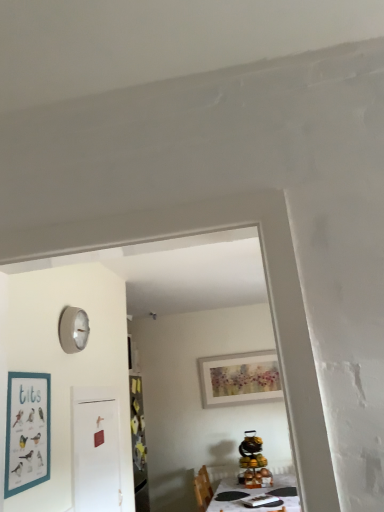
Measure the distance between white glossy table at lower center and camera.

The depth of white glossy table at lower center is 10.64 feet.

Find the location of a particular element. This screenshot has width=384, height=512. white glossy table at lower center is located at coordinates (256, 495).

What do you see at coordinates (27, 431) in the screenshot? I see `teal matte picture frame at left, the first picture frame from the front` at bounding box center [27, 431].

At what (x,y) coordinates should I click in order to perform the action: click on white glossy table at lower center. Please return your answer as a coordinate pair (x, y). This screenshot has width=384, height=512. Looking at the image, I should click on (256, 495).

From the picture: Which object is further away from the camera taking this photo, white glossy table at lower center or white matte door at center?

white glossy table at lower center is further away from the camera.

From a real-world perspective, does white glossy table at lower center sit lower than white matte door at center?

Correct, in the physical world, white glossy table at lower center is lower than white matte door at center.

Is white glossy table at lower center taller than white matte door at center?

Incorrect, the height of white glossy table at lower center is not larger of that of white matte door at center.

Which is in front, point (288, 498) or point (78, 415)?

Positioned in front is point (78, 415).

Would you consider teal matte picture frame at left, the 1th picture frame in the left-to-right sequence, to be distant from white matte door at center?

No, there isn't a large distance between teal matte picture frame at left, the 1th picture frame in the left-to-right sequence, and white matte door at center.

What's the angular difference between teal matte picture frame at left, marked as the second picture frame in a right-to-left arrangement, and white matte door at center's facing directions?

0.654 degrees separate the facing orientations of teal matte picture frame at left, marked as the second picture frame in a right-to-left arrangement, and white matte door at center.

How distant is teal matte picture frame at left, the second picture frame ordered from the bottom, from white matte door at center?

21.36 inches.

Considering the points (21, 429) and (82, 408), which point is behind, point (21, 429) or point (82, 408)?

Point (82, 408)

Does point (37, 464) lie in front of point (244, 354)?

That is True.

Is teal matte picture frame at left, the first picture frame from the front, next to watercolor paper picture frame at upper center, positioned as the second picture frame in top-to-bottom order, and touching it?

No, teal matte picture frame at left, the first picture frame from the front, is not touching watercolor paper picture frame at upper center, positioned as the second picture frame in top-to-bottom order.

Which of these two, teal matte picture frame at left, the 2th picture frame viewed from the back, or watercolor paper picture frame at upper center, arranged as the 1th picture frame when viewed from the right, stands taller?

Standing taller between the two is watercolor paper picture frame at upper center, arranged as the 1th picture frame when viewed from the right.

Is watercolor paper picture frame at upper center, which appears as the first picture frame when viewed from the back, far away from teal matte picture frame at left, the 1th picture frame when ordered from top to bottom?

watercolor paper picture frame at upper center, which appears as the first picture frame when viewed from the back, is far away from teal matte picture frame at left, the 1th picture frame when ordered from top to bottom.

I want to click on picture frame on the left of watercolor paper picture frame at upper center, the 1th picture frame positioned from the bottom, so click(x=27, y=431).

Between watercolor paper picture frame at upper center, arranged as the 2th picture frame when viewed from the front, and teal matte picture frame at left, marked as the second picture frame in a right-to-left arrangement, which one has smaller width?

Thinner between the two is teal matte picture frame at left, marked as the second picture frame in a right-to-left arrangement.

Would you say watercolor paper picture frame at upper center, the 1th picture frame positioned from the bottom, is inside or outside white matte door at center?

watercolor paper picture frame at upper center, the 1th picture frame positioned from the bottom, is located beyond the bounds of white matte door at center.

From a real-world perspective, is watercolor paper picture frame at upper center, arranged as the 1th picture frame when viewed from the right, positioned over white matte door at center based on gravity?

Correct, in the physical world, watercolor paper picture frame at upper center, arranged as the 1th picture frame when viewed from the right, is higher than white matte door at center.

From the image's perspective, is watercolor paper picture frame at upper center, marked as the 2th picture frame in a left-to-right arrangement, under white matte door at center?

Indeed, from the image's perspective, watercolor paper picture frame at upper center, marked as the 2th picture frame in a left-to-right arrangement, is shown beneath white matte door at center.

Is white matte door at center further to the viewer compared to teal matte picture frame at left, the 2th picture frame viewed from the back?

That is True.

Between white matte door at center and teal matte picture frame at left, the 1th picture frame in the left-to-right sequence, which one has less height?

teal matte picture frame at left, the 1th picture frame in the left-to-right sequence.

From the image's perspective, is white matte door at center on top of teal matte picture frame at left, the 1th picture frame when ordered from top to bottom?

Incorrect, from the image's perspective, white matte door at center is lower than teal matte picture frame at left, the 1th picture frame when ordered from top to bottom.

Is white glossy table at lower center turned away from teal matte picture frame at left, the first picture frame from the front?

No, white glossy table at lower center is not facing away from teal matte picture frame at left, the first picture frame from the front.

Could you measure the distance between white glossy table at lower center and teal matte picture frame at left, the 2th picture frame viewed from the back?

white glossy table at lower center and teal matte picture frame at left, the 2th picture frame viewed from the back, are 2.51 meters apart from each other.

Is white glossy table at lower center spatially inside teal matte picture frame at left, the 1th picture frame in the left-to-right sequence, or outside of it?

white glossy table at lower center is not enclosed by teal matte picture frame at left, the 1th picture frame in the left-to-right sequence.

Considering the points (286, 495) and (50, 435), which point is behind, point (286, 495) or point (50, 435)?

The point (286, 495) is farther from the camera.

Where is `fridge that is in front of the white glossy table at lower center`? fridge that is in front of the white glossy table at lower center is located at coordinates (96, 449).

Locate an element on the screen. The height and width of the screenshot is (512, 384). picture frame above the white matte door at center (from the image's perspective) is located at coordinates (27, 431).

Based on their spatial positions, is white glossy table at lower center or white matte door at center closer to teal matte picture frame at left, the 2th picture frame viewed from the back?

Answer: white matte door at center lies closer to teal matte picture frame at left, the 2th picture frame viewed from the back, than the other object.

Estimate the real-world distances between objects in this image. Which object is further from white matte door at center, white glossy table at lower center or teal matte picture frame at left, the 2th picture frame viewed from the back?

Based on the image, white glossy table at lower center appears to be further to white matte door at center.

Based on their spatial positions, is watercolor paper picture frame at upper center, positioned as the second picture frame in top-to-bottom order, or white matte door at center further from teal matte picture frame at left, the first picture frame from the front?

watercolor paper picture frame at upper center, positioned as the second picture frame in top-to-bottom order, is further to teal matte picture frame at left, the first picture frame from the front.

From the image, which object appears to be farther from watercolor paper picture frame at upper center, arranged as the 2th picture frame when viewed from the front, white matte door at center or white glossy table at lower center?

white matte door at center.

From the image, which object appears to be nearer to white glossy table at lower center, teal matte picture frame at left, the 2th picture frame viewed from the back, or white matte door at center?

white matte door at center is closer to white glossy table at lower center.

When comparing their distances from white glossy table at lower center, does white matte door at center or watercolor paper picture frame at upper center, arranged as the 2th picture frame when viewed from the front, seem closer?

The object closer to white glossy table at lower center is watercolor paper picture frame at upper center, arranged as the 2th picture frame when viewed from the front.

Considering their positions, is white matte door at center positioned further to watercolor paper picture frame at upper center, arranged as the 2th picture frame when viewed from the front, than teal matte picture frame at left, the 1th picture frame when ordered from top to bottom?

teal matte picture frame at left, the 1th picture frame when ordered from top to bottom, is further to watercolor paper picture frame at upper center, arranged as the 2th picture frame when viewed from the front.

Based on their spatial positions, is white glossy table at lower center or white matte door at center further from watercolor paper picture frame at upper center, the 1th picture frame positioned from the bottom?

white matte door at center is further to watercolor paper picture frame at upper center, the 1th picture frame positioned from the bottom.

Identify the location of table between white matte door at center and watercolor paper picture frame at upper center, the 1th picture frame positioned from the bottom, from front to back. (256, 495).

In order to click on table between teal matte picture frame at left, the second picture frame ordered from the bottom, and watercolor paper picture frame at upper center, arranged as the 1th picture frame when viewed from the right, in the front-back direction in this screenshot , I will do `click(256, 495)`.

Where is `fridge between teal matte picture frame at left, the second picture frame ordered from the bottom, and watercolor paper picture frame at upper center, arranged as the 1th picture frame when viewed from the right, in the front-back direction`? This screenshot has height=512, width=384. fridge between teal matte picture frame at left, the second picture frame ordered from the bottom, and watercolor paper picture frame at upper center, arranged as the 1th picture frame when viewed from the right, in the front-back direction is located at coordinates (96, 449).

At what (x,y) coordinates should I click in order to perform the action: click on fridge between teal matte picture frame at left, the 1th picture frame in the left-to-right sequence, and white glossy table at lower center in the up-down direction. Please return your answer as a coordinate pair (x, y). Looking at the image, I should click on (96, 449).